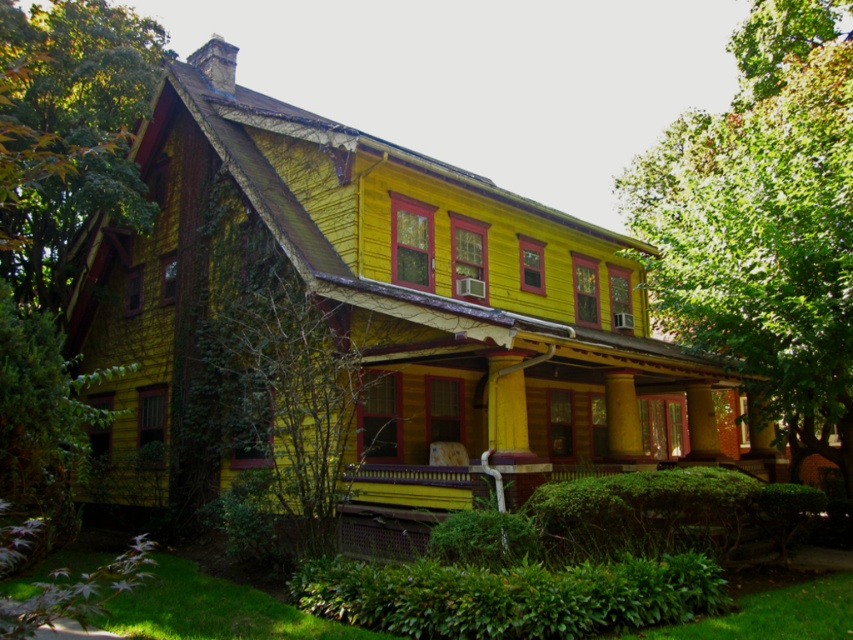
You are standing in front of the house and want to see both the green leafy tree at upper right and the green leafy tree at left. Which tree is closer to you?

The green leafy tree at upper right is closer to you because the green leafy tree at left is behind it.

You are standing in front of the house and want to take a photo of the green leafy tree at left. If your camera can focus on objects up to 8 meters away, will you be able to capture the tree clearly?

The distance between the green leafy tree at left and the camera is 7.82 meters, which is within the camera focus range of up to 8 meters. Therefore, you can capture the tree clearly.

You are a bird flying over the two green leafy trees in the scene. Which tree, the green leafy tree at left or the green leafy tree at center, would you prefer to land on if you want to be higher up?

The green leafy tree at left is above the green leafy tree at center, so you should choose the green leafy tree at left to land on if you want to be higher up.